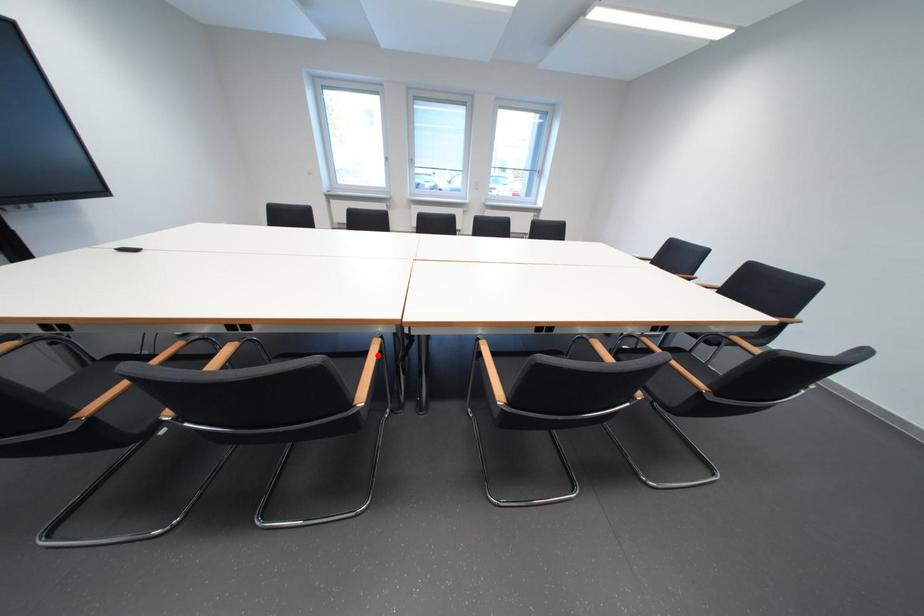
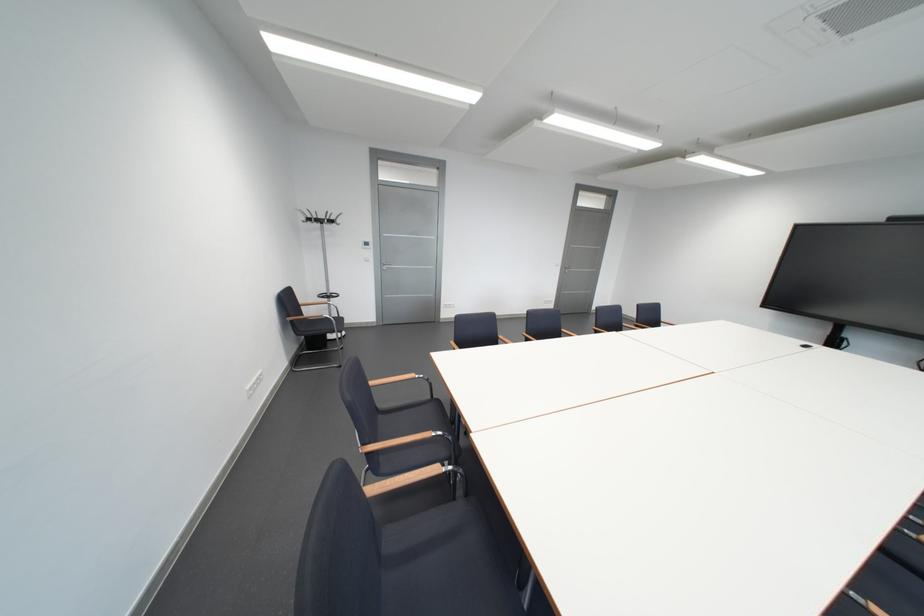
Question: I am providing you with two images of the same scene from different viewpoints. A red point is marked on the first image. At the location where the point appears in image 1, is it still visible in image 2?

Choices:
 (A) Yes
 (B) No

Answer: (B)